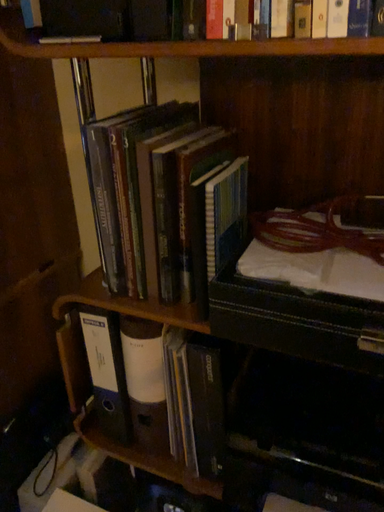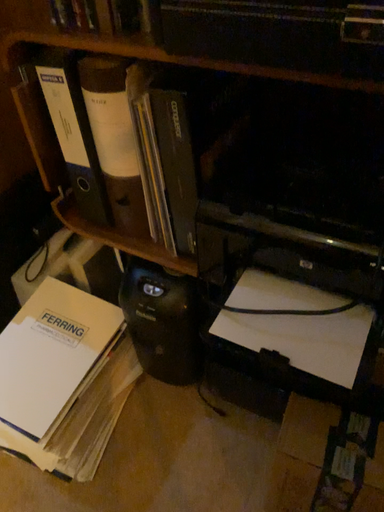
Question: How did the camera likely rotate when shooting the video?

Choices:
 (A) rotated downward
 (B) rotated upward

Answer: (A)